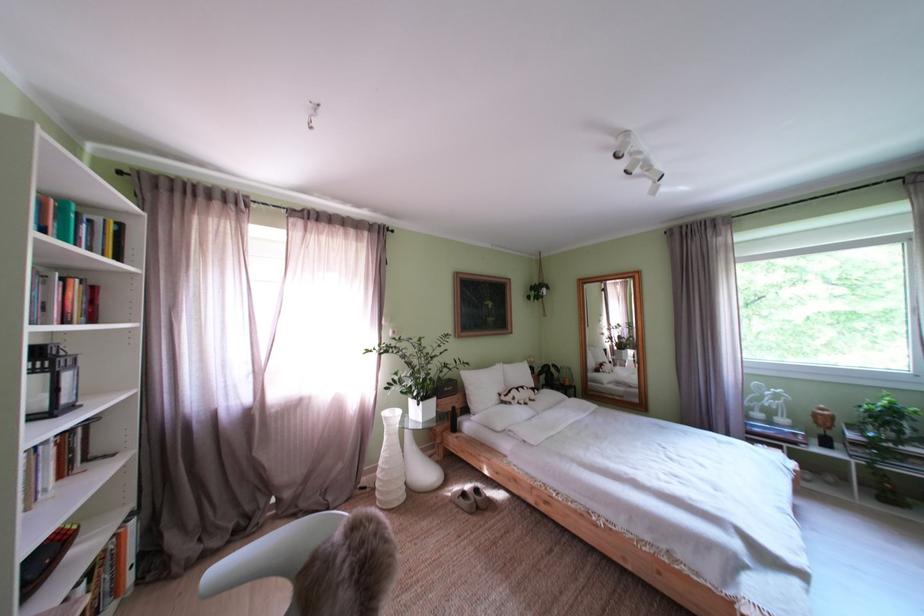
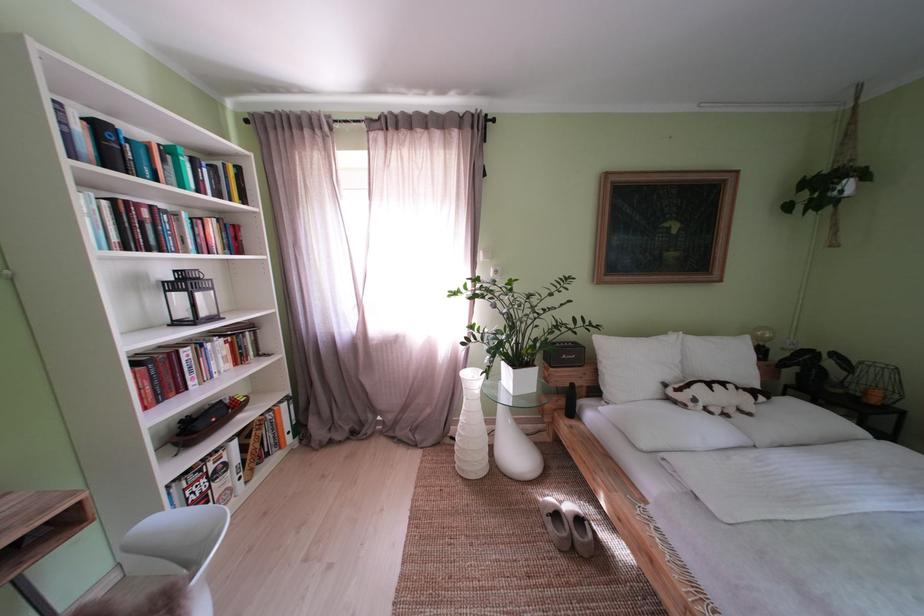
Question: The first image is from the beginning of the video and the second image is from the end. How did the camera likely rotate when shooting the video?

Choices:
 (A) Left
 (B) Right
 (C) Up
 (D) Down

Answer: (A)